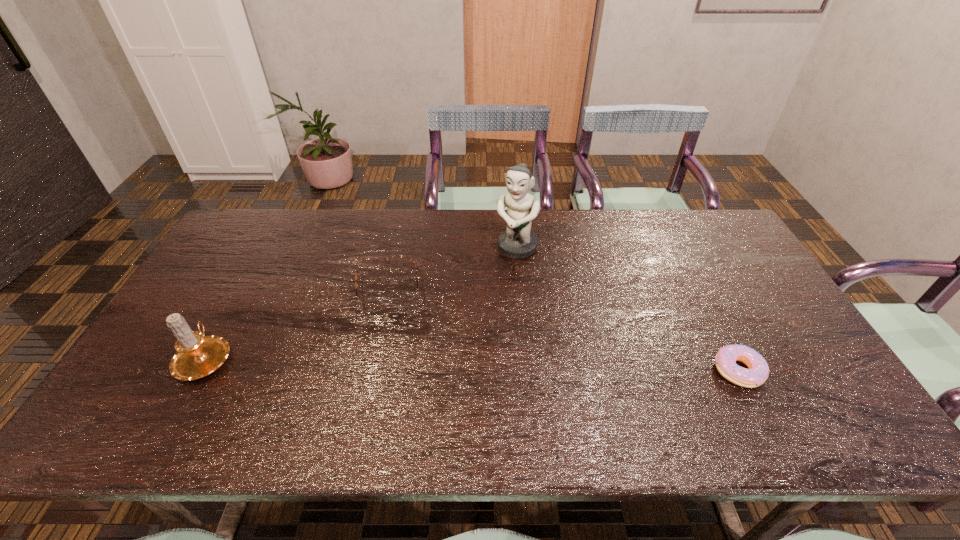
Where is `free space between the tallest object and the doughnut`? This screenshot has width=960, height=540. free space between the tallest object and the doughnut is located at coordinates (627, 309).

Identify the location of free space between the third object from right to left and the doughnut. (564, 330).

Find the location of a particular element. free spot between the candle and the doughnut is located at coordinates (472, 364).

Locate an element on the screen. Image resolution: width=960 pixels, height=540 pixels. vacant area that lies between the third shortest object and the spectacles is located at coordinates [298, 324].

Find the location of a particular element. The width and height of the screenshot is (960, 540). blank region between the third object from left to right and the doughnut is located at coordinates pyautogui.click(x=627, y=309).

Where is `free space between the rightmost object and the third shortest object`? free space between the rightmost object and the third shortest object is located at coordinates (472, 364).

The height and width of the screenshot is (540, 960). I want to click on vacant space in between the farthest object and the third object from right to left, so click(453, 269).

In order to click on vacant space in between the leftmost object and the rightmost object in this screenshot , I will do `click(472, 364)`.

Select which object is the second closest to the doughnut. Please provide its 2D coordinates. Your answer should be formatted as a tuple, i.e. [(x, y)], where the tuple contains the x and y coordinates of a point satisfying the conditions above.

[(406, 301)]

You are a GUI agent. You are given a task and a screenshot of the screen. Output one action in this format:
    pyautogui.click(x=<x>, y=<y>)
    Task: Click on the second closest object to the shortest object
    
    Given the screenshot: What is the action you would take?
    pyautogui.click(x=406, y=301)